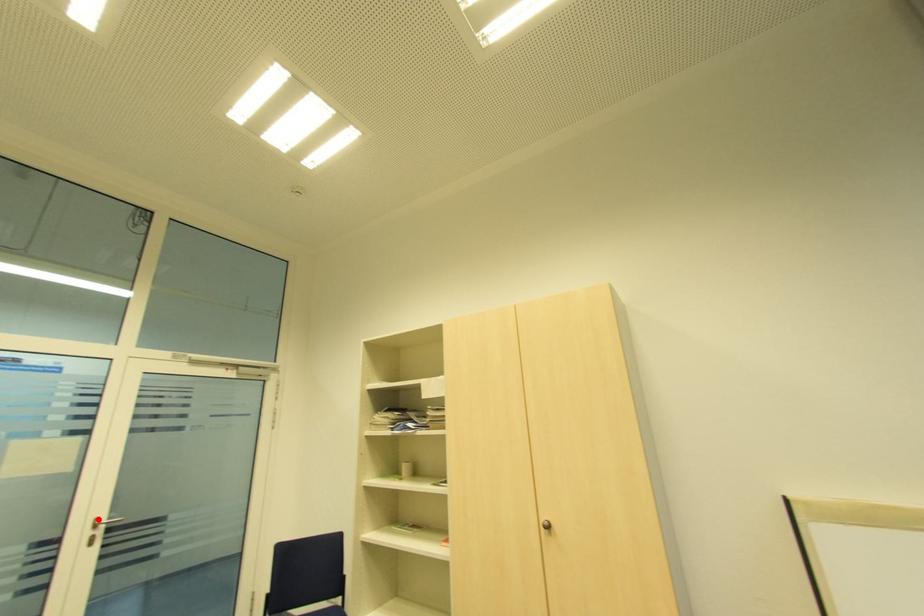
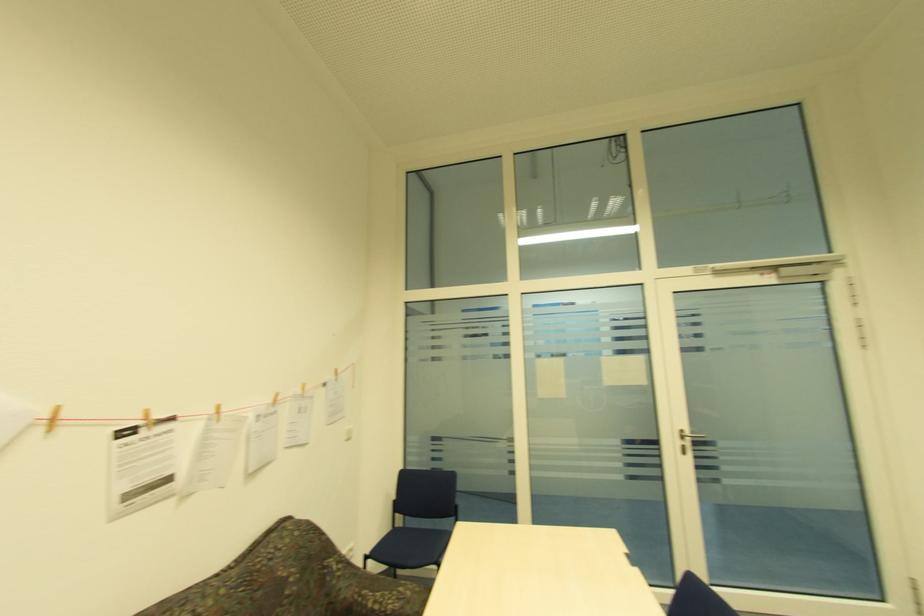
Question: I am providing you with two images of the same scene from different viewpoints. Image1 has a red point marked. In image2, the corresponding 3D location appears at what relative position? Reply with the corresponding letter.

Choices:
 (A) Closer
 (B) Farther

Answer: (B)